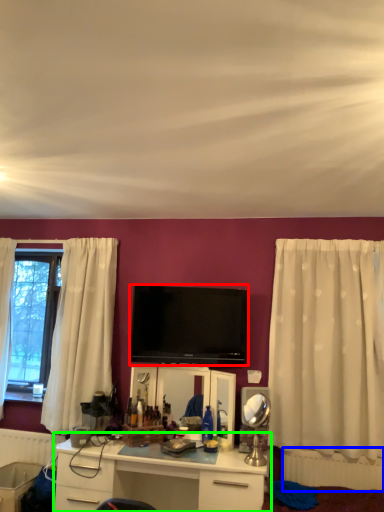
Question: Considering the real-world distances, which object is farthest from television (highlighted by a red box)? radiator (highlighted by a blue box) or desk (highlighted by a green box)?

Choices:
 (A) radiator
 (B) desk

Answer: (A)